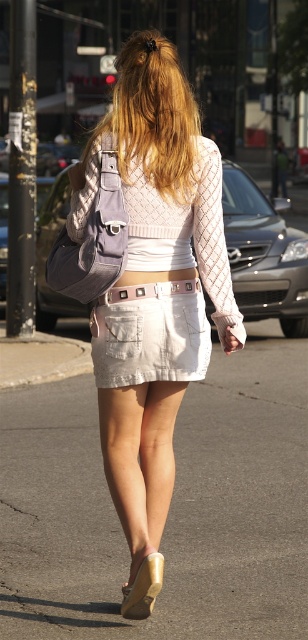
You are a fashion designer observing a model wearing the described outfit. You need to adjust the length of the skirt to ensure it reaches the tan leather sandal at lower center. Currently, the skirt ends at the white leather belt at center. How much longer should the skirt be in meters?

The distance between the tan leather sandal at lower center and the white leather belt at center is 1.67 meters. To make the skirt reach the sandal, it needs to be extended by 1.67 meters.

You are standing in front of the person in the image and want to place a sticker on either the point at coordinate point [24,636] or the point at coordinate point [146,179]. Which point is closer to you?

The point at coordinate point [24,636] is closer to you than the point at coordinate point [146,179].

You are a photographer trying to capture the person in the image. You want to ensure the light gray asphalt at center and the blonde hair at upper center are both visible in the frame. Which object should you focus on first to ensure both are in focus?

The light gray asphalt at center is shorter than the blonde hair at upper center, so you should focus on the blonde hair at upper center first to ensure both are in focus.